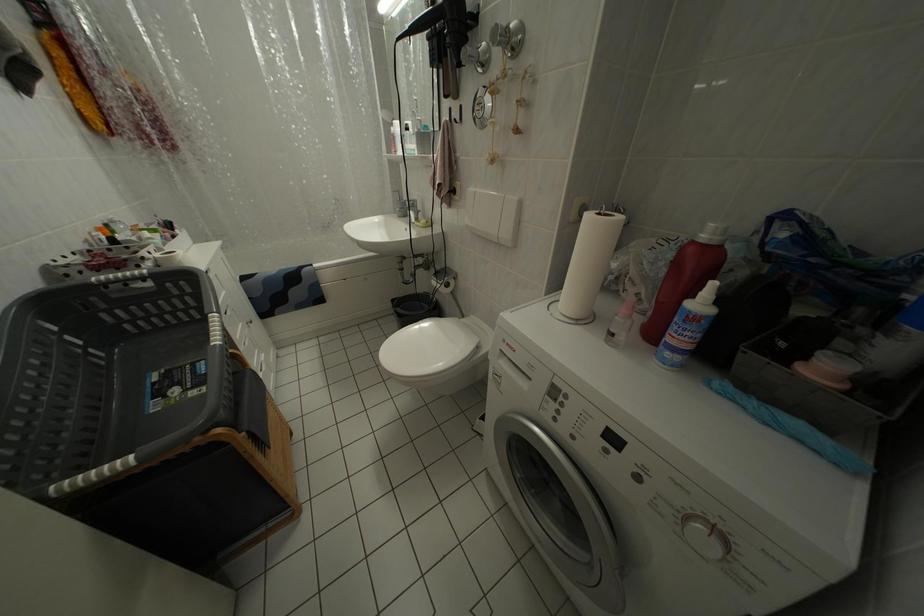
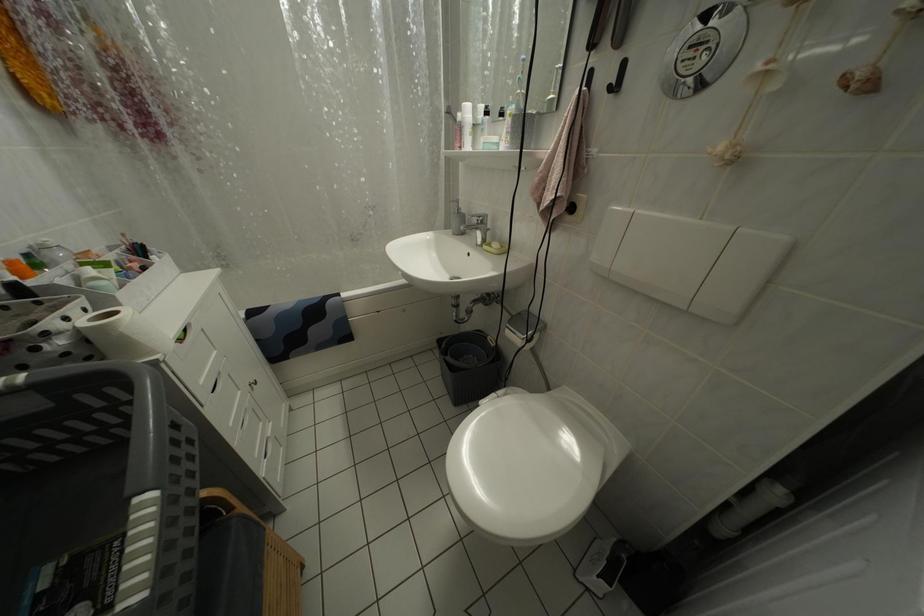
Which direction would the cameraman need to move to produce the second image?

The cameraman walked toward left, forward.